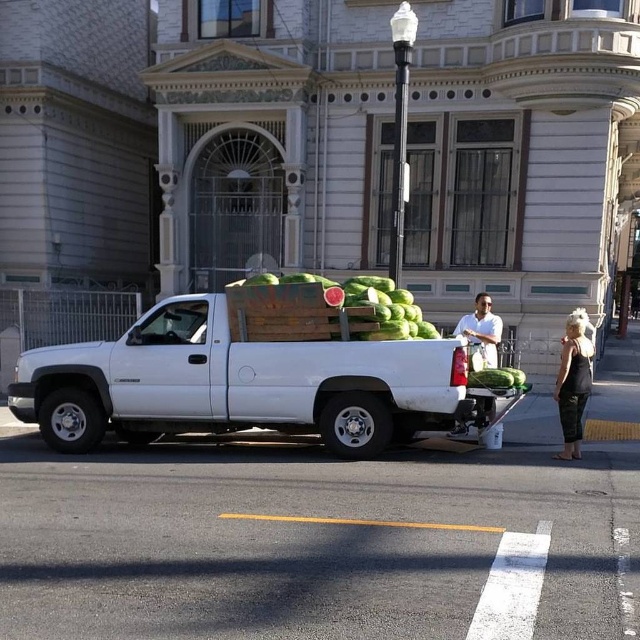
Between white matte truck at center and white matte shirt at center, which one is positioned higher?

white matte shirt at center is above.

In order to click on white matte truck at center in this screenshot , I will do pos(237,384).

Is green matte watermelons at center shorter than white matte shirt at center?

Yes, green matte watermelons at center is shorter than white matte shirt at center.

Who is positioned more to the right, green matte watermelons at center or white matte shirt at center?

Positioned to the right is white matte shirt at center.

Consider the image. Measure the distance between green matte watermelons at center and camera.

A: They are 10.10 meters apart.

Identify the location of green matte watermelons at center. (321, 308).

Can you confirm if white matte truck at center is taller than green matte watermelons at center?

Yes.

Is point (161, 381) closer to camera compared to point (376, 312)?

That is False.

This screenshot has height=640, width=640. I want to click on white matte truck at center, so click(x=237, y=384).